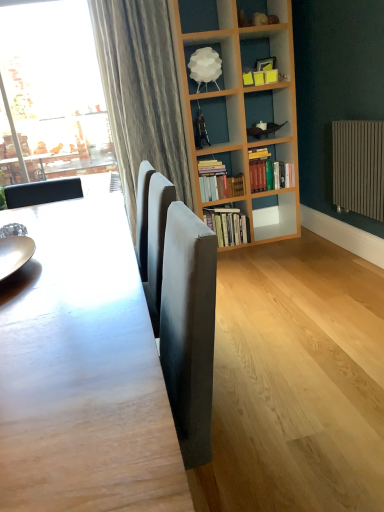
Question: From the image's perspective, is brown metallic radiator at right located above or below smooth wooden table at center?

Choices:
 (A) below
 (B) above

Answer: (B)

Question: Based on their sizes in the image, would you say brown metallic radiator at right is bigger or smaller than smooth wooden table at center?

Choices:
 (A) small
 (B) big

Answer: (A)

Question: Considering the real-world distances, which object is farthest from the hardcover books at center, which ranks as the 1th book in top-to-bottom order?

Choices:
 (A) smooth wooden table at center
 (B) hardcover books at center, acting as the second book starting from the top
 (C) brown metallic radiator at right
 (D) hardcover books at center, arranged as the first book when ordered from the bottom
 (E) shiny metallic plate at left

Answer: (E)

Question: Which object is the farthest from the white matte lampshade at upper center?

Choices:
 (A) hardcover books at center, which ranks as the 1th book in top-to-bottom order
 (B) hardcover books at center, the 2th book in the bottom-to-top sequence
 (C) hardcover books at center, the 3th book when ordered from top to bottom
 (D) smooth wooden table at center
 (E) brown metallic radiator at right

Answer: (D)